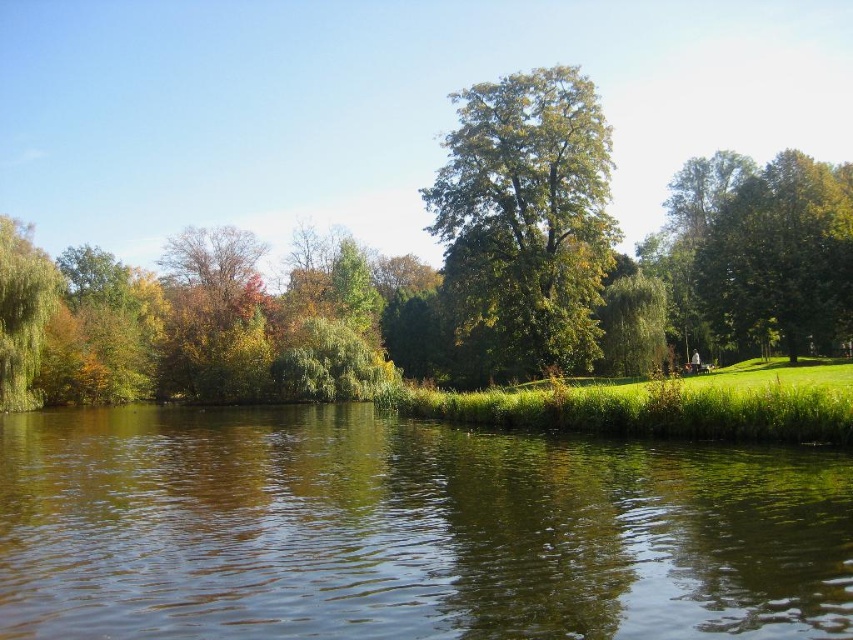
Question: Is green grassy bank at lower center positioned behind green leafy tree at upper right?

Choices:
 (A) yes
 (B) no

Answer: (B)

Question: Does green grassy bank at lower center appear on the right side of green leafy tree at upper right?

Choices:
 (A) no
 (B) yes

Answer: (A)

Question: Does green grassy bank at lower center have a lesser width compared to green leafy tree at left?

Choices:
 (A) yes
 (B) no

Answer: (B)

Question: Which object is farther from the camera taking this photo?

Choices:
 (A) green leafy tree at upper right
 (B) green grassy bank at lower center
 (C) green leafy tree at center

Answer: (C)

Question: Which point is closer to the camera?

Choices:
 (A) green leafy tree at left
 (B) green leafy tree at center
 (C) green grassy bank at lower center
 (D) green leafy tree at upper right

Answer: (C)

Question: Which object is closer to the camera taking this photo?

Choices:
 (A) green leafy tree at center
 (B) green grassy bank at lower center
 (C) green leafy tree at left

Answer: (B)